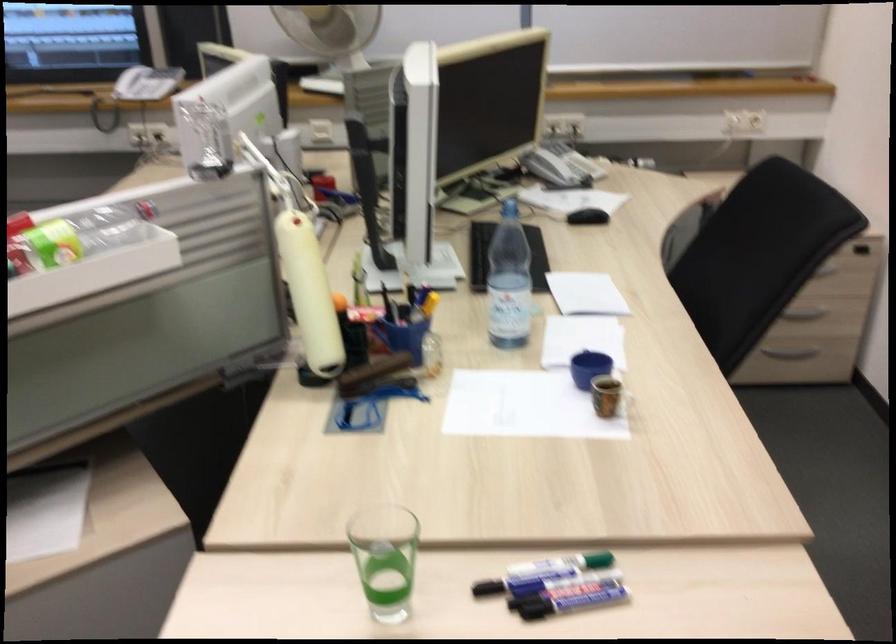
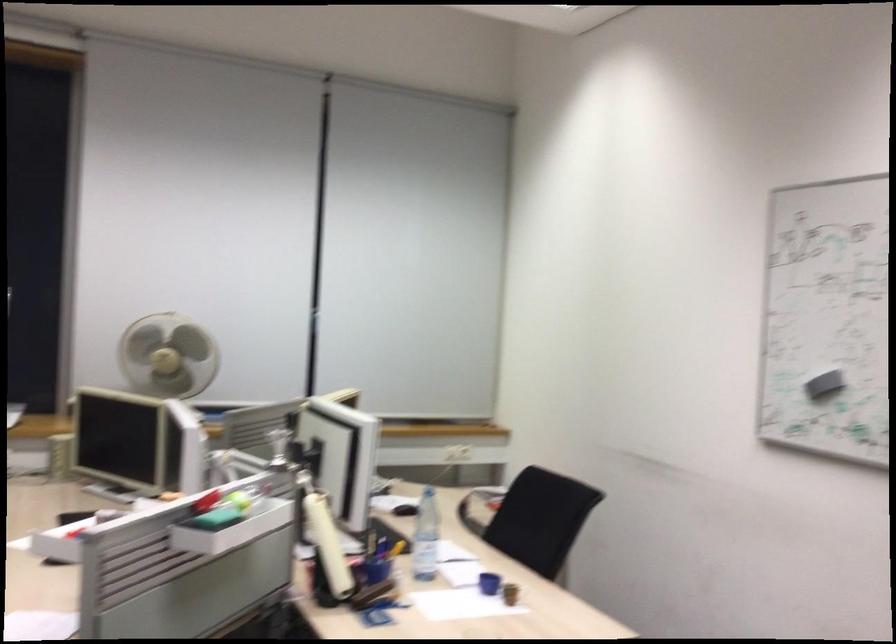
The point at (419, 321) is marked in the first image. Where is the corresponding point in the second image?

(377, 563)